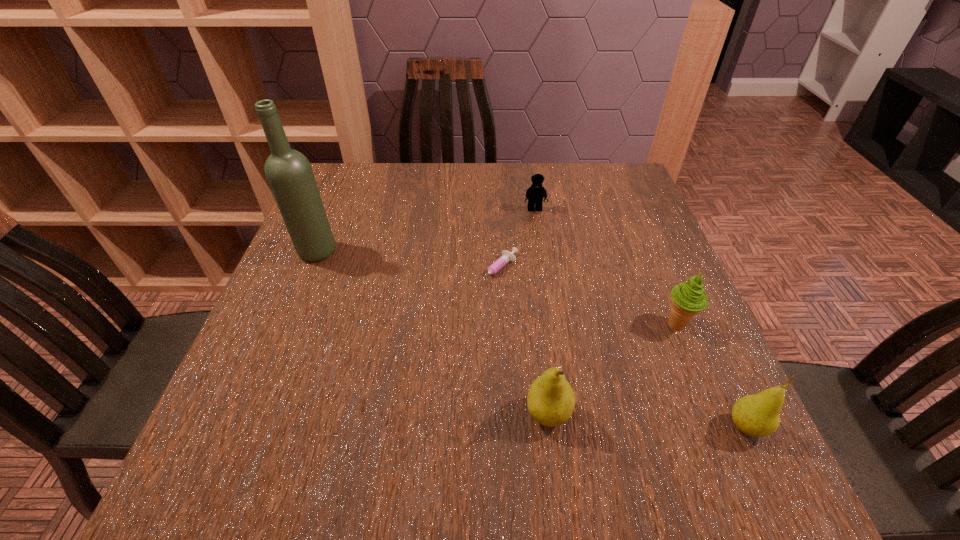
Observe the arrangement of all pears in the image. To keep them evenly spaced, where would you place another pear on the left? Please locate a free space. Please provide its 2D coordinates. Your answer should be formatted as a tuple, i.e. [(x, y)], where the tuple contains the x and y coordinates of a point satisfying the conditions above.

[(359, 402)]